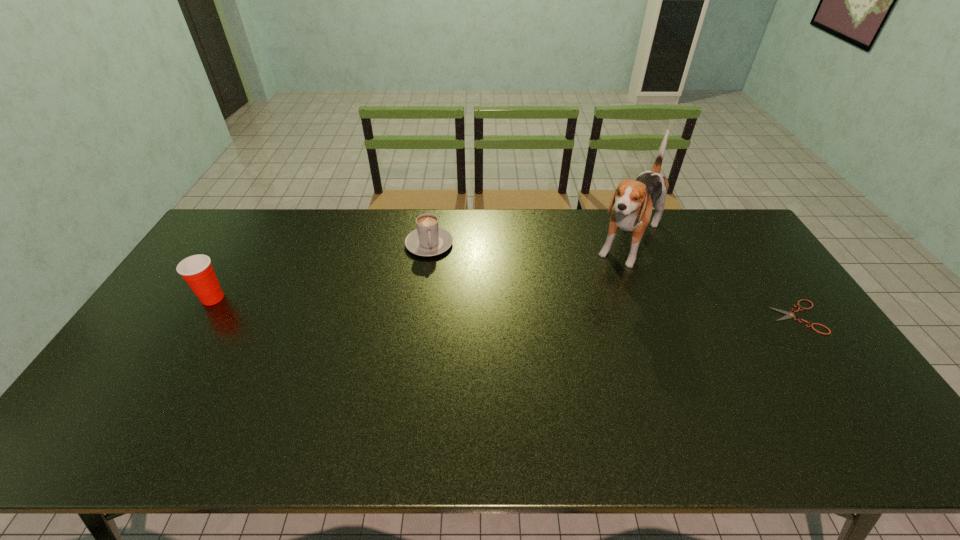
You are a GUI agent. You are given a task and a screenshot of the screen. Output one action in this format:
    pyautogui.click(x=<x>, y=<y>)
    Task: Click on the free space at the far edge of the desktop
    
    Given the screenshot: What is the action you would take?
    pyautogui.click(x=291, y=239)

In the image, there is a desktop. Find the location of `vacant space at the near edge`. vacant space at the near edge is located at coordinates pos(430,389).

Find the location of a particular element. The image size is (960, 540). vacant space at the left edge of the desktop is located at coordinates (236, 259).

Locate an element on the screen. free space at the right edge is located at coordinates (825, 354).

The image size is (960, 540). I want to click on vacant position at the far left corner of the desktop, so click(246, 216).

The width and height of the screenshot is (960, 540). In the image, there is a desktop. Identify the location of vacant area at the near left corner. (134, 393).

Image resolution: width=960 pixels, height=540 pixels. I want to click on vacant point located between the puppy and the rightmost object, so click(713, 280).

Locate an element on the screen. The width and height of the screenshot is (960, 540). free space between the Dixie cup and the shears is located at coordinates (505, 307).

You are a GUI agent. You are given a task and a screenshot of the screen. Output one action in this format:
    pyautogui.click(x=<x>, y=<y>)
    Task: Click on the vacant space in between the leftmost object and the puppy
    This screenshot has height=540, width=960.
    Given the screenshot: What is the action you would take?
    pyautogui.click(x=421, y=271)

You are a GUI agent. You are given a task and a screenshot of the screen. Output one action in this format:
    pyautogui.click(x=<x>, y=<y>)
    Task: Click on the free area in between the tallest object and the rightmost object
    The height and width of the screenshot is (540, 960).
    Given the screenshot: What is the action you would take?
    pyautogui.click(x=713, y=280)